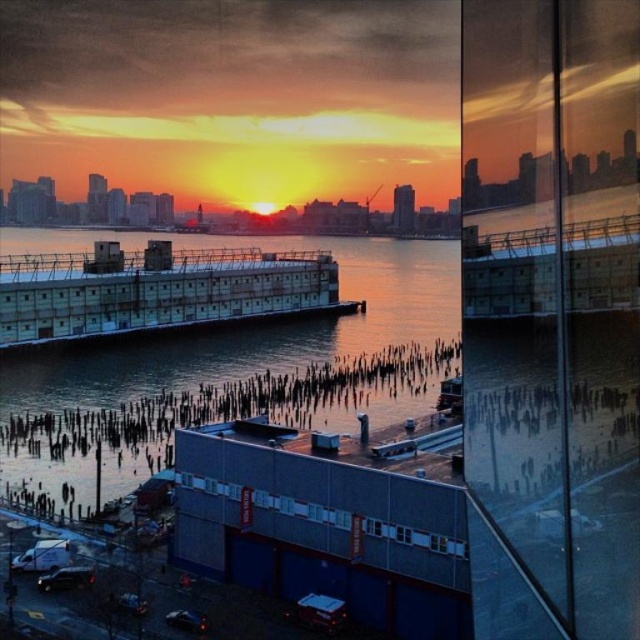
Is reflective glass water at center wider than blue matte building at center?

Yes.

Who is more forward, (340, 276) or (371, 522)?

Point (371, 522) is more forward.

Describe the element at coordinates (237, 371) in the screenshot. This screenshot has height=640, width=640. I see `reflective glass water at center` at that location.

Where is `reflective glass water at center`? reflective glass water at center is located at coordinates (237, 371).